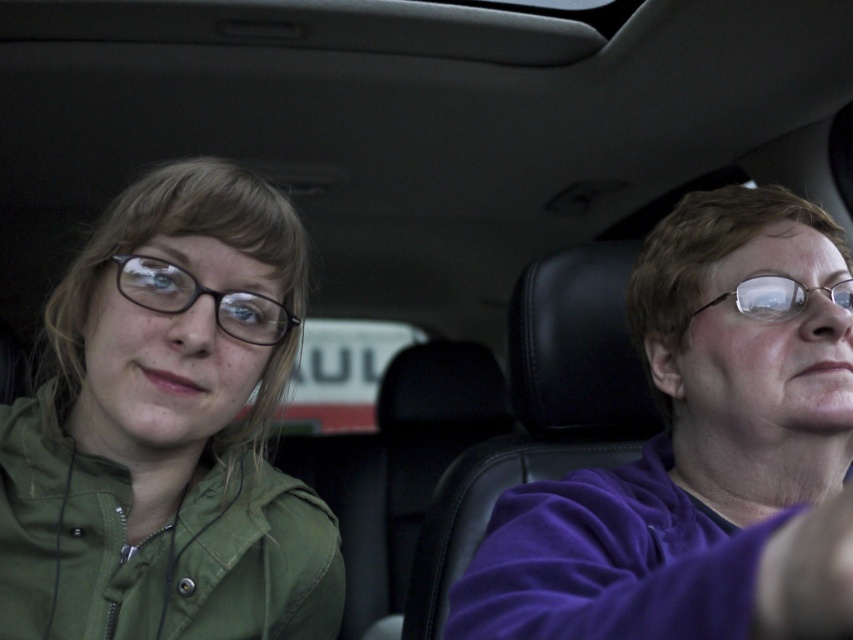
Question: Does black plastic glasses at left appear under clear plastic glasses at right?

Choices:
 (A) no
 (B) yes

Answer: (B)

Question: Is matte green jacket at left behind purple fleece at right?

Choices:
 (A) yes
 (B) no

Answer: (A)

Question: Estimate the real-world distances between objects in this image. Which object is farther from the purple fleece at right?

Choices:
 (A) clear plastic glasses at right
 (B) black plastic glasses at left

Answer: (B)

Question: Can you confirm if purple fleece at right is thinner than clear plastic glasses at right?

Choices:
 (A) no
 (B) yes

Answer: (A)

Question: Which point appears closest to the camera in this image?

Choices:
 (A) (236, 333)
 (B) (213, 349)

Answer: (B)

Question: Which object is the closest to the black plastic glasses at left?

Choices:
 (A) matte green jacket at left
 (B) purple fleece at right

Answer: (A)